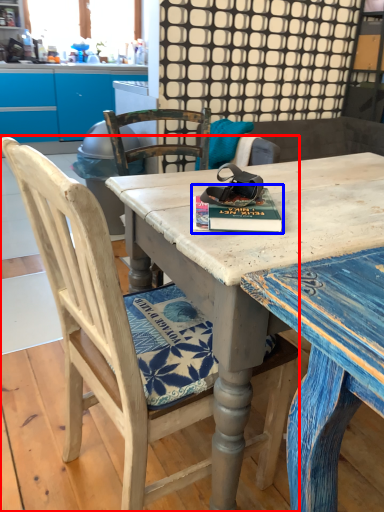
Question: Which of the following is the farthest to the observer, chair (highlighted by a red box) or paperback book (highlighted by a blue box)?

Choices:
 (A) chair
 (B) paperback book

Answer: (B)